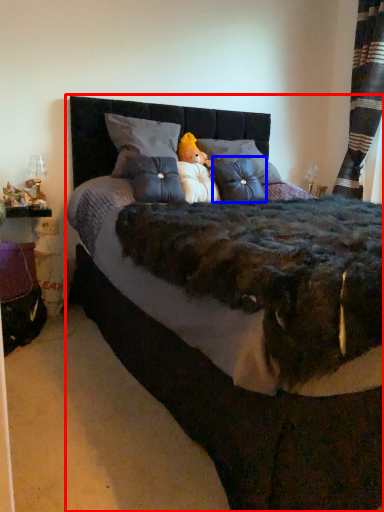
Question: Which of the following is the farthest to the observer, bed (highlighted by a red box) or throw pillow (highlighted by a blue box)?

Choices:
 (A) bed
 (B) throw pillow

Answer: (B)